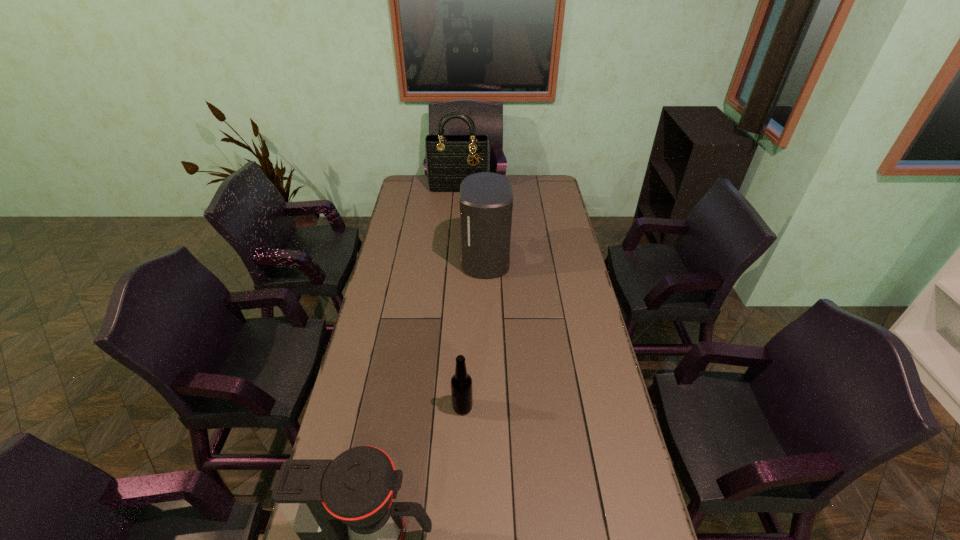
The height and width of the screenshot is (540, 960). Find the location of `the farthest object`. the farthest object is located at coordinates (448, 162).

You are a GUI agent. You are given a task and a screenshot of the screen. Output one action in this format:
    pyautogui.click(x=<x>, y=<y>)
    Task: Click on the farther coffee maker
    This screenshot has width=960, height=540.
    Given the screenshot: What is the action you would take?
    pyautogui.click(x=486, y=199)

At what (x,y) coordinates should I click in order to perform the action: click on the right coffee maker. Please return your answer as a coordinate pair (x, y). This screenshot has width=960, height=540. Looking at the image, I should click on (486, 199).

Identify the location of beer bottle. (461, 382).

I want to click on the second nearest object, so click(461, 382).

At what (x,y) coordinates should I click in order to perform the action: click on blank area located 0.260m at the front of the farthest object with visible charms. Please return your answer as a coordinate pair (x, y). Looking at the image, I should click on pos(456,221).

Image resolution: width=960 pixels, height=540 pixels. What are the coordinates of `blank space located on the button side of the right coffee maker` in the screenshot? It's located at (423, 259).

Where is `blank space located 0.050m on the button side of the right coffee maker`? blank space located 0.050m on the button side of the right coffee maker is located at coordinates (449, 259).

Identify the location of vacant point located 0.180m on the button side of the right coffee maker. Image resolution: width=960 pixels, height=540 pixels. (419, 259).

At what (x,y) coordinates should I click in order to perform the action: click on vacant region located 0.070m on the back of the shortest object. Please return your answer as a coordinate pair (x, y). The image size is (960, 540). Looking at the image, I should click on (464, 380).